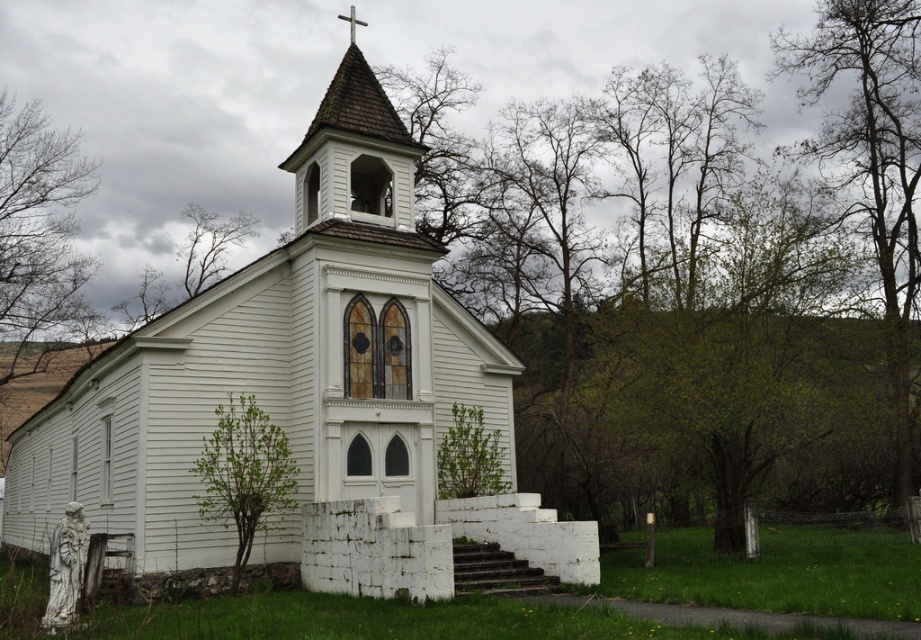
You are standing in front of the white wood church at center and looking towards the bare branches at left. Which object is higher in the image?

The bare branches at left are higher than the white wood church at center because the church is positioned below them.

You are standing at the entrance of the white wood church at center. You want to know where you are located in the image. What are the coordinates of your current position?

The coordinates of the white wood church at center are at point (302,394).